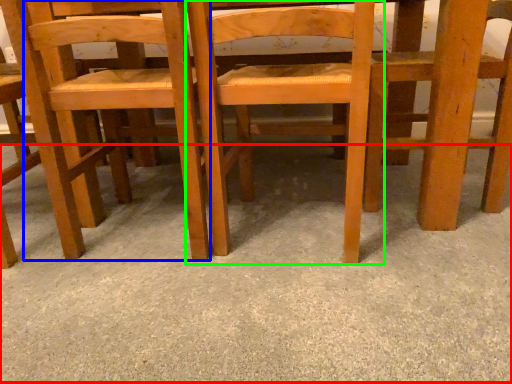
Question: Based on their relative distances, which object is farther from concrete (highlighted by a red box)? Choose from chair (highlighted by a blue box) and chair (highlighted by a green box).

Choices:
 (A) chair
 (B) chair

Answer: (A)